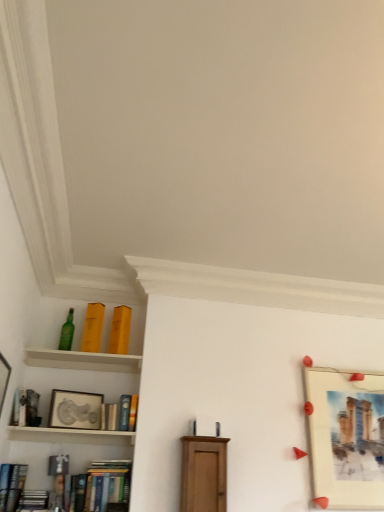
This screenshot has width=384, height=512. I want to click on free space behind matte yellow book at upper left, which is the first book from top to bottom, so click(96, 359).